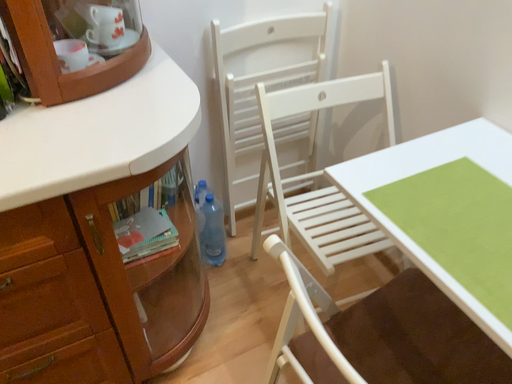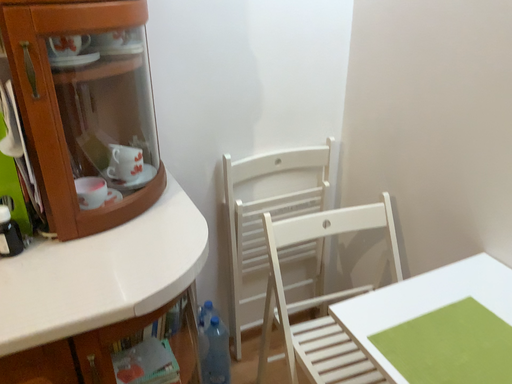
Question: Which way did the camera rotate in the video?

Choices:
 (A) rotated downward
 (B) rotated upward

Answer: (B)